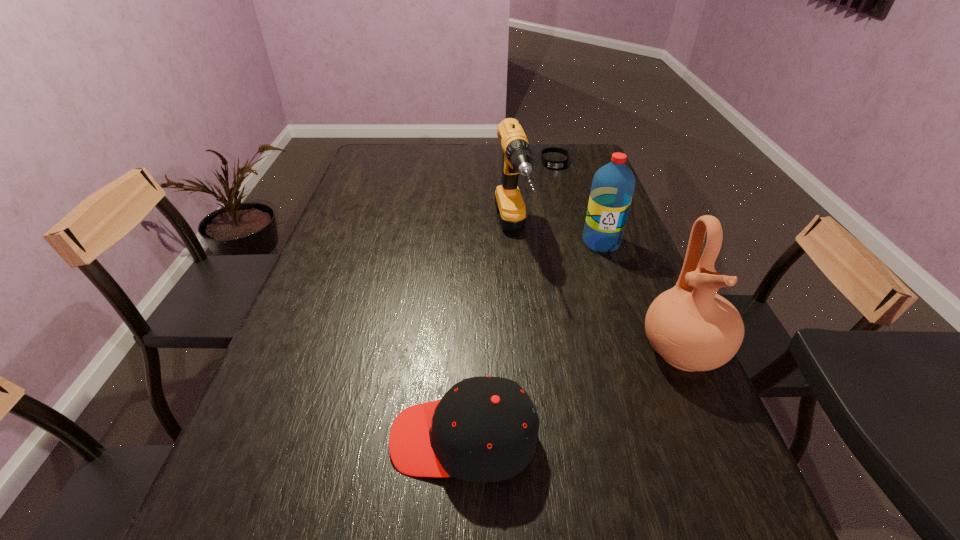
Choose which object is the fourth nearest neighbor to the farthest object. Please provide its 2D coordinates. Your answer should be formatted as a tuple, i.e. [(x, y)], where the tuple contains the x and y coordinates of a point satisfying the conditions above.

[(484, 429)]

You are a GUI agent. You are given a task and a screenshot of the screen. Output one action in this format:
    pyautogui.click(x=<x>, y=<y>)
    Task: Click on the object that is the third nearest to the water bottle
    
    Given the screenshot: What is the action you would take?
    pyautogui.click(x=549, y=164)